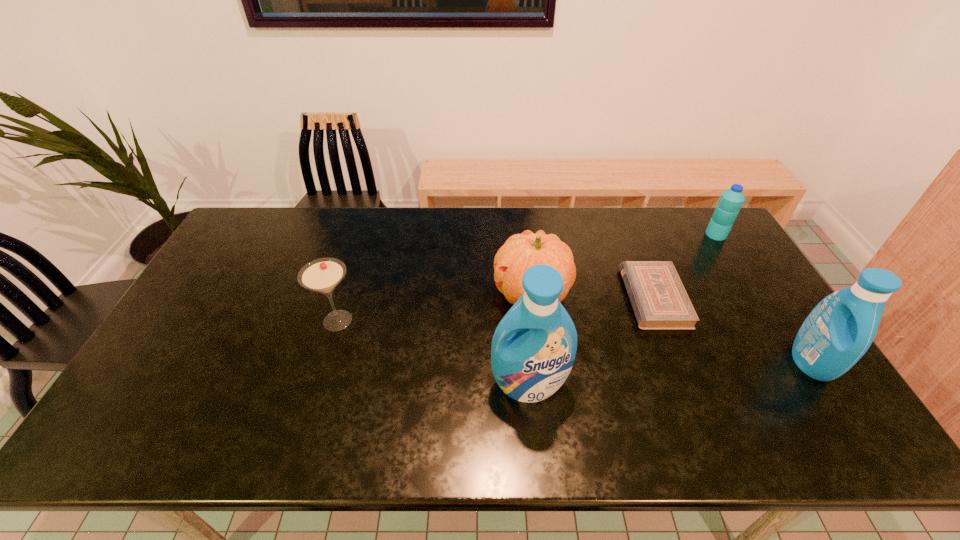
Identify the location of the left detergent. The height and width of the screenshot is (540, 960). (534, 346).

What are the coordinates of `the tallest object` in the screenshot? It's located at (534, 346).

Find the location of `the fifth shortest object`. the fifth shortest object is located at coordinates (840, 329).

Where is `the right detergent`? Image resolution: width=960 pixels, height=540 pixels. the right detergent is located at coordinates (840, 329).

Locate an element on the screen. water bottle is located at coordinates (731, 200).

At what (x,y) coordinates should I click in order to perform the action: click on the third object from right to left. Please return your answer as a coordinate pair (x, y). Image resolution: width=960 pixels, height=540 pixels. Looking at the image, I should click on (659, 300).

Where is `Bible`? Bible is located at coordinates (659, 300).

Where is `the leftmost object`? The height and width of the screenshot is (540, 960). the leftmost object is located at coordinates (322, 275).

You are a GUI agent. You are given a task and a screenshot of the screen. Output one action in this format:
    pyautogui.click(x=<x>, y=<y>)
    Task: Click on the third tallest object
    This screenshot has width=960, height=540.
    Given the screenshot: What is the action you would take?
    pyautogui.click(x=521, y=251)

Locate an element on the screen. Image resolution: width=960 pixels, height=540 pixels. vacant area situated on the left of the farthest object is located at coordinates (655, 234).